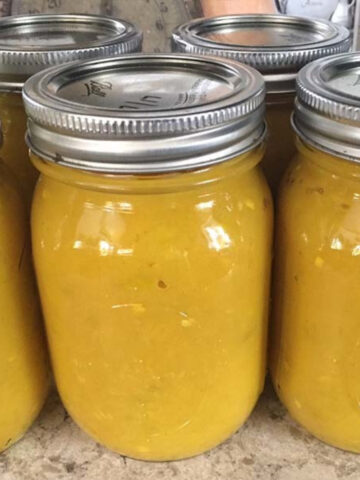
You are a GUI agent. You are given a task and a screenshot of the screen. Output one action in this format:
    pyautogui.click(x=<x>, y=<y>)
    Task: Click on the jar lids
    This screenshot has height=480, width=360.
    Given the screenshot: What is the action you would take?
    pyautogui.click(x=180, y=92), pyautogui.click(x=276, y=36), pyautogui.click(x=341, y=80)